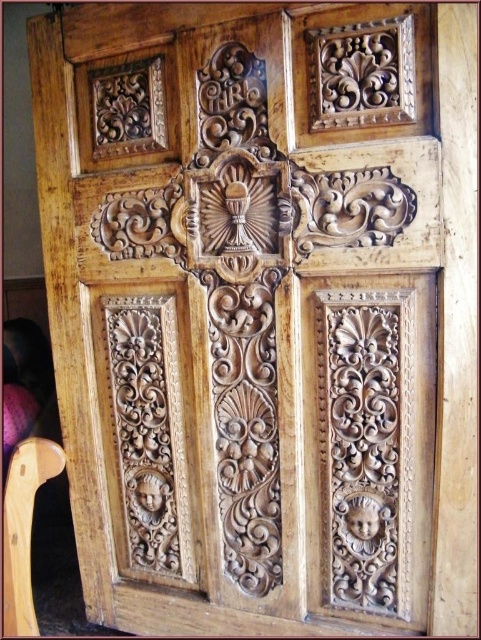
Measure the distance between light brown wood carving at center-right and light brown wood chair at lower left.

19.63 inches

Who is more distant from viewer, (396, 572) or (16, 582)?

Point (16, 582)

The height and width of the screenshot is (640, 481). Describe the element at coordinates (363, 452) in the screenshot. I see `light brown wood carving at center-right` at that location.

The image size is (481, 640). Identify the location of light brown wood carving at center-right. (363, 452).

Between point (151, 401) and point (21, 481), which one is positioned behind?

The point (151, 401) is behind.

Is light brown wood carving at lower left to the left of light brown wood chair at lower left from the viewer's perspective?

In fact, light brown wood carving at lower left is to the right of light brown wood chair at lower left.

Who is more distant from viewer, (x=139, y=356) or (x=32, y=492)?

The point (x=139, y=356) is more distant.

Identify the location of light brown wood carving at lower left. Image resolution: width=481 pixels, height=640 pixels. (148, 426).

Is light brown wood carving at center-right taller than light brown wood carving at lower left?

No, light brown wood carving at center-right is not taller than light brown wood carving at lower left.

Locate an element on the screen. light brown wood carving at center-right is located at coordinates (363, 452).